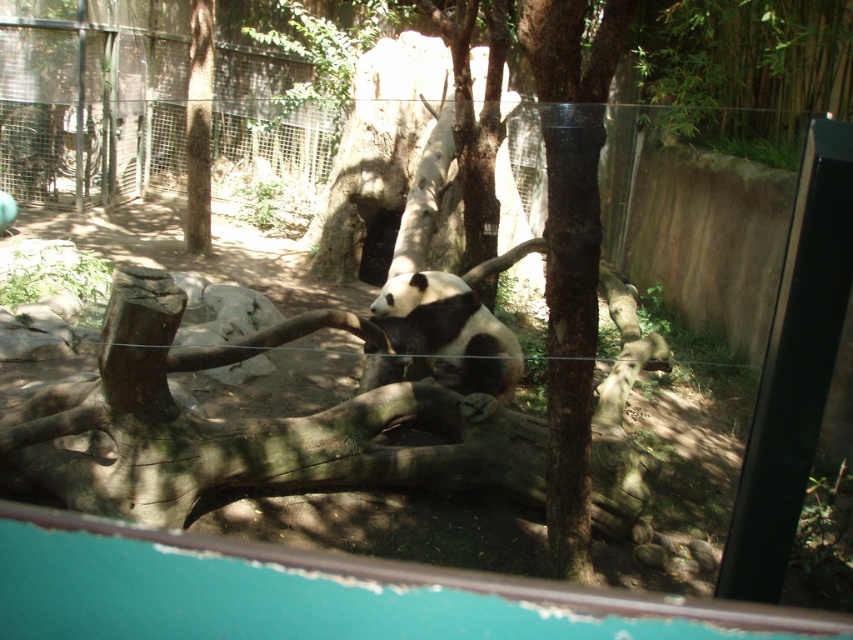
Consider the image. You are a zookeeper who needs to place a feeding tray between the black and white fur at center and the brown rough tree trunk at upper left. The tray requires at least 5 meters of space to be placed safely. Can you place it there?

The distance between the black and white fur at center and the brown rough tree trunk at upper left is 4.99 meters, which is just shy of the required 5 meters. Therefore, the feeding tray cannot be placed safely in that location.

You are a zookeeper standing at point A and need to reach point B to feed the panda. The path between them is blocked by a fallen log. If point A is at coordinates point (x=204, y=81) and point B is at coordinates point (x=471, y=289), which point is closer to the panda bear?

Point B at coordinates point (x=471, y=289) is closer to the panda bear because it is in front of point A at coordinates point (x=204, y=81).